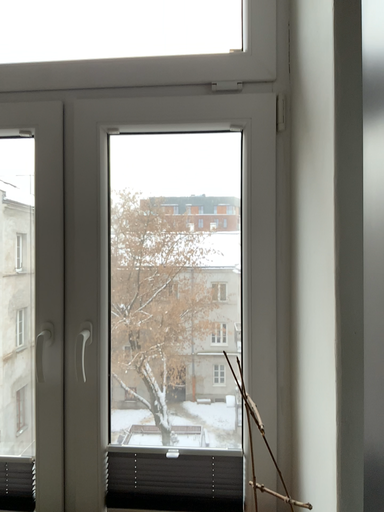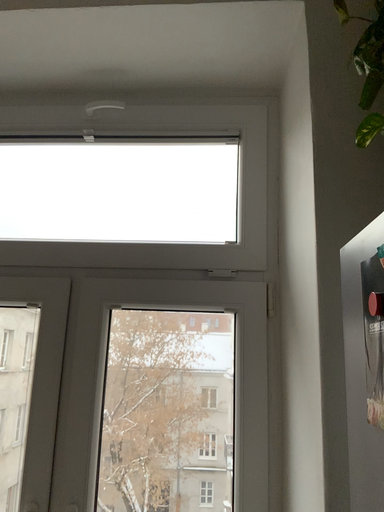
Question: How did the camera likely rotate when shooting the video?

Choices:
 (A) rotated downward
 (B) rotated upward

Answer: (B)